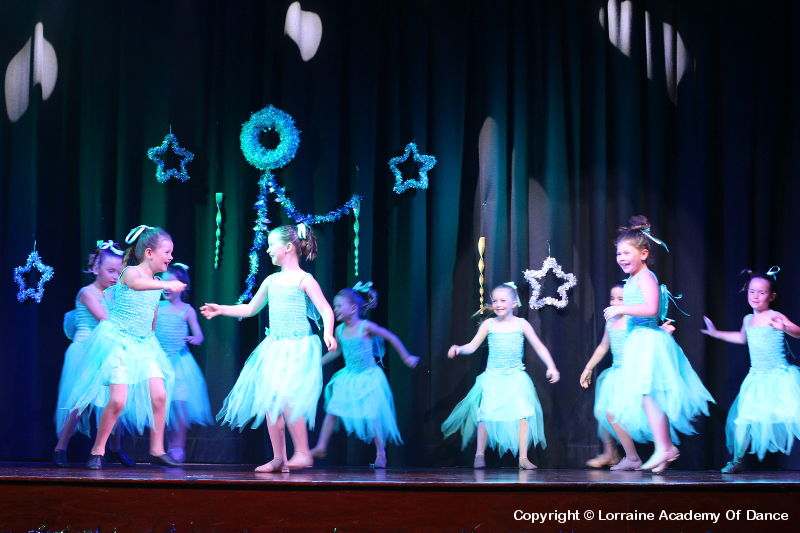
Identify the location of blue and turquoise hanging streamers. (358, 224), (269, 256).